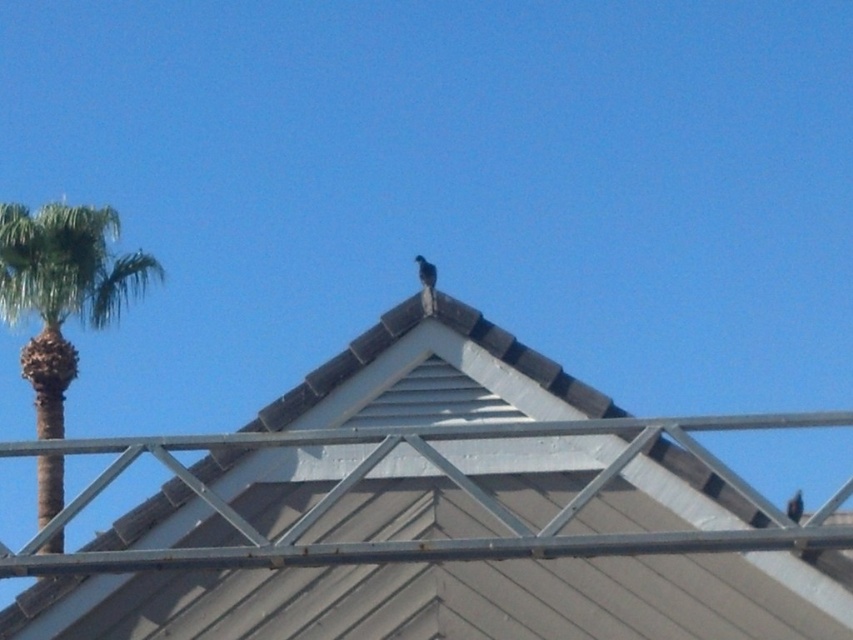
You are a birdhouse builder looking to install a new birdhouse on the roof. The birdhouse requires a space larger than the brown shingles at center. Can the green leafy palm tree at left provide enough space for the birdhouse?

The brown shingles at center has a smaller size compared to green leafy palm tree at left, so the green leafy palm tree at left is larger and can provide enough space for the birdhouse.

You are a birdwatcher observing the roof scene. You notice two birds on the roofline. Which bird is sitting higher up on the roof between the shiny blue bird at upper center and the dark brown feathered bird at upper center?

The shiny blue bird at upper center is sitting higher up on the roof because it is positioned over the dark brown feathered bird at upper center.

You are a birdwatcher observing the roof scene. You notice two birds on the roofline. Which bird is closer to you, the shiny blue bird at upper center or the dark brown feathered bird at upper center?

The shiny blue bird at upper center is closer to you because the dark brown feathered bird at upper center is positioned behind it.